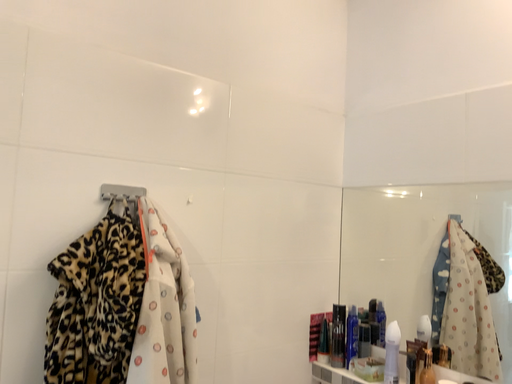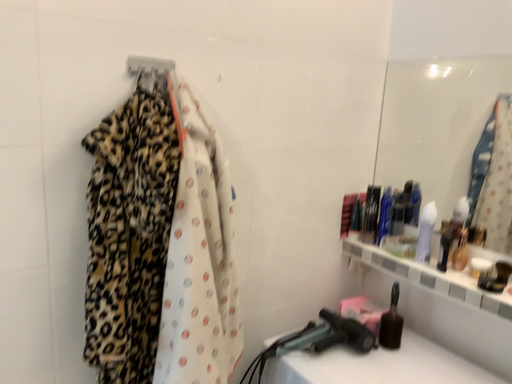
Question: Which way did the camera rotate in the video?

Choices:
 (A) rotated upward
 (B) rotated downward

Answer: (B)